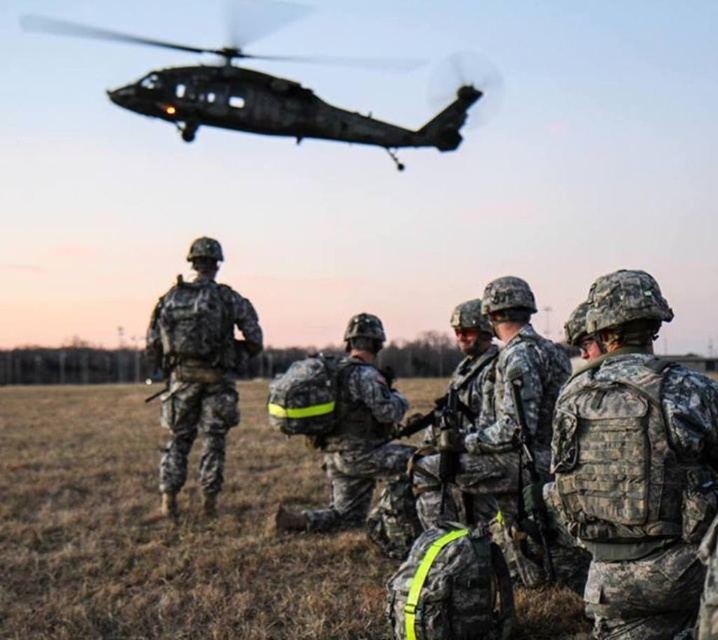
Question: Can you confirm if camouflage backpack at center is positioned below camouflage uniform at center?

Choices:
 (A) yes
 (B) no

Answer: (A)

Question: Does camouflage fabric vest at center have a smaller size compared to black matte helicopter at upper left?

Choices:
 (A) yes
 (B) no

Answer: (A)

Question: Among these objects, which one is nearest to the camera?

Choices:
 (A) camouflage uniform at center
 (B) camouflage fabric vest at center
 (C) black matte helicopter at upper left

Answer: (B)

Question: Which point appears closest to the camera in this image?

Choices:
 (A) (322, 419)
 (B) (192, 252)

Answer: (A)

Question: Is camouflage backpack at center further to the viewer compared to camouflage uniform at center?

Choices:
 (A) no
 (B) yes

Answer: (A)

Question: Based on their relative distances, which object is nearer to the camouflage backpack at center?

Choices:
 (A) camouflage fabric vest at center
 (B) black matte helicopter at upper left
 (C) camouflage uniform at center

Answer: (C)